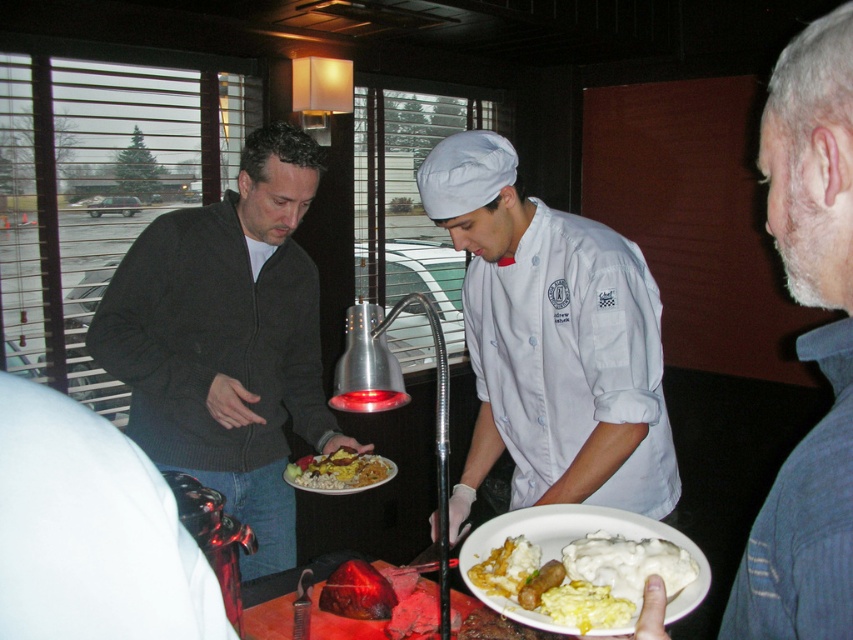
Question: Does white cotton chef's coat at center have a larger size compared to white creamy mashed potatoes at lower center?

Choices:
 (A) yes
 (B) no

Answer: (A)

Question: Can you confirm if gray beard at right is positioned below white creamy mashed potatoes at lower center?

Choices:
 (A) no
 (B) yes

Answer: (A)

Question: Which point appears closest to the camera in this image?

Choices:
 (A) (631, 552)
 (B) (347, 456)
 (C) (469, 154)
 (D) (784, 54)

Answer: (D)

Question: Among these points, which one is nearest to the camera?

Choices:
 (A) pos(614,625)
 (B) pos(267,497)

Answer: (A)

Question: Is dark gray sweater at left to the left of gray beard at right from the viewer's perspective?

Choices:
 (A) no
 (B) yes

Answer: (B)

Question: Among these points, which one is nearest to the camera?

Choices:
 (A) (483, 323)
 (B) (567, 625)
 (C) (157, 237)
 (D) (331, 460)

Answer: (B)